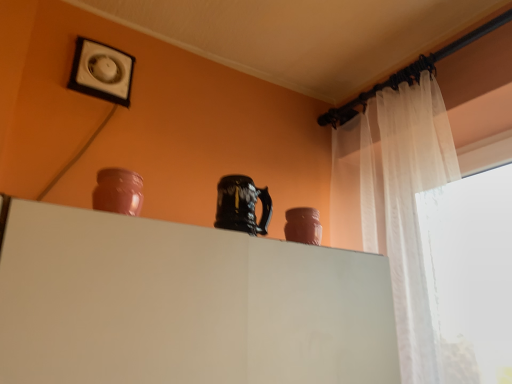
Question: In terms of width, does matte pink vase at right, which is the 2th vase in front-to-back order, look wider or thinner when compared to matte clay vase at upper left, which ranks as the 1th vase in left-to-right order?

Choices:
 (A) wide
 (B) thin

Answer: (A)

Question: In terms of size, does matte pink vase at right, acting as the 2th vase starting from the left, appear bigger or smaller than matte clay vase at upper left, the first vase when ordered from front to back?

Choices:
 (A) big
 (B) small

Answer: (A)

Question: Based on their relative distances, which object is farther from the white glossy vent at upper left?

Choices:
 (A) glossy ceramic mug at upper center
 (B) matte clay vase at upper left, arranged as the first vase when viewed from the top
 (C) matte pink vase at right, which is counted as the 1th vase, starting from the back

Answer: (C)

Question: Which object is the closest to the matte clay vase at upper left, marked as the 2th vase in a bottom-to-top arrangement?

Choices:
 (A) matte pink vase at right, which is the 2th vase in front-to-back order
 (B) glossy ceramic mug at upper center
 (C) white glossy vent at upper left

Answer: (B)